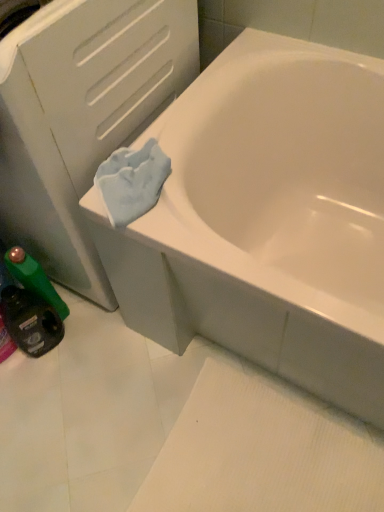
Describe the element at coordinates (81, 116) in the screenshot. I see `white matte file cabinet at upper left` at that location.

Find the location of a particular element. green plastic mouthwash at lower left, which appears as the second mouthwash when viewed from the top is located at coordinates (30, 321).

Find the location of `white glossy bathtub at upper right`. white glossy bathtub at upper right is located at coordinates (267, 219).

Which is behind, green plastic bottle at lower left, which is counted as the 2th mouthwash, starting from the bottom, or white glossy bathtub at upper right?

green plastic bottle at lower left, which is counted as the 2th mouthwash, starting from the bottom, is further from the camera.

Would you say green plastic bottle at lower left, the 1th mouthwash in the top-to-bottom sequence, is outside white glossy bathtub at upper right?

Yes, green plastic bottle at lower left, the 1th mouthwash in the top-to-bottom sequence, is outside of white glossy bathtub at upper right.

Does green plastic bottle at lower left, the 1th mouthwash in the top-to-bottom sequence, have a smaller size compared to white glossy bathtub at upper right?

Indeed, green plastic bottle at lower left, the 1th mouthwash in the top-to-bottom sequence, has a smaller size compared to white glossy bathtub at upper right.

Is green plastic bottle at lower left, the 1th mouthwash in the top-to-bottom sequence, positioned far away from white glossy bathtub at upper right?

Actually, green plastic bottle at lower left, the 1th mouthwash in the top-to-bottom sequence, and white glossy bathtub at upper right are a little close together.

Is white matte file cabinet at upper left far from white glossy bathtub at upper right?

No, white matte file cabinet at upper left is not far away from white glossy bathtub at upper right.

You are a GUI agent. You are given a task and a screenshot of the screen. Output one action in this format:
    pyautogui.click(x=<x>, y=<y>)
    Task: Click on the file cabinet on the left of white glossy bathtub at upper right
    This screenshot has height=512, width=384.
    Given the screenshot: What is the action you would take?
    pyautogui.click(x=81, y=116)

What's the angular difference between white matte file cabinet at upper left and white glossy bathtub at upper right's facing directions?

The angular difference between white matte file cabinet at upper left and white glossy bathtub at upper right is 7.59e-06 degrees.

Which of these two, white matte file cabinet at upper left or white glossy bathtub at upper right, is smaller?

white matte file cabinet at upper left is smaller.

From a real-world perspective, is green plastic mouthwash at lower left, which appears as the second mouthwash when viewed from the top, positioned under green plastic bottle at lower left, the 1th mouthwash in the top-to-bottom sequence, based on gravity?

Yes.

Considering the positions of point (35, 351) and point (13, 274), is point (35, 351) closer or farther from the camera than point (13, 274)?

Point (35, 351) is positioned farther from the camera compared to point (13, 274).

Are green plastic mouthwash at lower left, the first mouthwash positioned from the bottom, and green plastic bottle at lower left, which is counted as the 2th mouthwash, starting from the bottom, far apart?

Actually, green plastic mouthwash at lower left, the first mouthwash positioned from the bottom, and green plastic bottle at lower left, which is counted as the 2th mouthwash, starting from the bottom, are a little close together.

Between green plastic mouthwash at lower left, which appears as the second mouthwash when viewed from the top, and green plastic bottle at lower left, the 1th mouthwash in the top-to-bottom sequence, which one has larger width?

green plastic mouthwash at lower left, which appears as the second mouthwash when viewed from the top, is wider.

Looking at this image, is green plastic bottle at lower left, the 1th mouthwash in the top-to-bottom sequence, inside white matte file cabinet at upper left?

No, green plastic bottle at lower left, the 1th mouthwash in the top-to-bottom sequence, is not surrounded by white matte file cabinet at upper left.

Does white matte file cabinet at upper left have a greater width compared to green plastic bottle at lower left, which is counted as the 2th mouthwash, starting from the bottom?

Correct, the width of white matte file cabinet at upper left exceeds that of green plastic bottle at lower left, which is counted as the 2th mouthwash, starting from the bottom.

There is a white matte file cabinet at upper left. Identify the location of the 1st mouthwash below it (from the image's perspective). (34, 279).

Is green plastic bottle at lower left, which is counted as the 2th mouthwash, starting from the bottom, at the back of white matte file cabinet at upper left?

That's not correct — white matte file cabinet at upper left is not looking away from green plastic bottle at lower left, which is counted as the 2th mouthwash, starting from the bottom.

Starting from the white glossy bathtub at upper right, which mouthwash is the 1st one to the left? Please provide its 2D coordinates.

[(34, 279)]

How far apart are white glossy bathtub at upper right and green plastic bottle at lower left, the 1th mouthwash in the top-to-bottom sequence?

white glossy bathtub at upper right and green plastic bottle at lower left, the 1th mouthwash in the top-to-bottom sequence, are 23.29 inches apart from each other.

Based on their sizes in the image, would you say white glossy bathtub at upper right is bigger or smaller than green plastic bottle at lower left, which is counted as the 2th mouthwash, starting from the bottom?

white glossy bathtub at upper right is bigger than green plastic bottle at lower left, which is counted as the 2th mouthwash, starting from the bottom.

Would you say white glossy bathtub at upper right is inside or outside green plastic bottle at lower left, the 1th mouthwash in the top-to-bottom sequence?

white glossy bathtub at upper right exists outside the volume of green plastic bottle at lower left, the 1th mouthwash in the top-to-bottom sequence.

Measure the distance between white matte file cabinet at upper left and green plastic mouthwash at lower left, which appears as the second mouthwash when viewed from the top.

A distance of 44.36 centimeters exists between white matte file cabinet at upper left and green plastic mouthwash at lower left, which appears as the second mouthwash when viewed from the top.

Which is in front, point (136, 2) or point (8, 288)?

The point (136, 2) is closer.

Between white matte file cabinet at upper left and green plastic mouthwash at lower left, the first mouthwash positioned from the bottom, which one has less height?

Standing shorter between the two is green plastic mouthwash at lower left, the first mouthwash positioned from the bottom.

Find the location of a particular element. mouthwash that is the 2nd one when counting downward from the white matte file cabinet at upper left (from the image's perspective) is located at coordinates (30, 321).

Is white glossy bathtub at upper right far from green plastic mouthwash at lower left, the first mouthwash positioned from the bottom?

No, white glossy bathtub at upper right is not far away from green plastic mouthwash at lower left, the first mouthwash positioned from the bottom.

Which object is closer to the camera taking this photo, white glossy bathtub at upper right or green plastic mouthwash at lower left, which appears as the second mouthwash when viewed from the top?

white glossy bathtub at upper right.

Considering the positions of objects white glossy bathtub at upper right and green plastic mouthwash at lower left, the first mouthwash positioned from the bottom, in the image provided, who is more to the left, white glossy bathtub at upper right or green plastic mouthwash at lower left, the first mouthwash positioned from the bottom,?

From the viewer's perspective, green plastic mouthwash at lower left, the first mouthwash positioned from the bottom, appears more on the left side.

Where is `the 1st mouthwash to the left of the white glossy bathtub at upper right, starting your count from the anchor`? The width and height of the screenshot is (384, 512). the 1st mouthwash to the left of the white glossy bathtub at upper right, starting your count from the anchor is located at coordinates (34, 279).

The height and width of the screenshot is (512, 384). What are the coordinates of `bathtub to the right of white matte file cabinet at upper left` in the screenshot? It's located at (267, 219).

Consider the image. Which object lies nearer to the anchor point green plastic mouthwash at lower left, which appears as the second mouthwash when viewed from the top, white matte file cabinet at upper left or green plastic bottle at lower left, which is counted as the 2th mouthwash, starting from the bottom?

green plastic bottle at lower left, which is counted as the 2th mouthwash, starting from the bottom, lies closer to green plastic mouthwash at lower left, which appears as the second mouthwash when viewed from the top, than the other object.

From the image, which object appears to be farther from green plastic mouthwash at lower left, the first mouthwash positioned from the bottom, green plastic bottle at lower left, the 1th mouthwash in the top-to-bottom sequence, or white glossy bathtub at upper right?

Based on the image, white glossy bathtub at upper right appears to be further to green plastic mouthwash at lower left, the first mouthwash positioned from the bottom.

Considering their positions, is green plastic bottle at lower left, the 1th mouthwash in the top-to-bottom sequence, positioned closer to white matte file cabinet at upper left than green plastic mouthwash at lower left, which appears as the second mouthwash when viewed from the top?

Among the two, green plastic bottle at lower left, the 1th mouthwash in the top-to-bottom sequence, is located nearer to white matte file cabinet at upper left.

When comparing their distances from white matte file cabinet at upper left, does green plastic bottle at lower left, the 1th mouthwash in the top-to-bottom sequence, or white glossy bathtub at upper right seem further?

green plastic bottle at lower left, the 1th mouthwash in the top-to-bottom sequence, lies further to white matte file cabinet at upper left than the other object.

Based on their spatial positions, is green plastic mouthwash at lower left, the first mouthwash positioned from the bottom, or white matte file cabinet at upper left closer to green plastic bottle at lower left, the 1th mouthwash in the top-to-bottom sequence?

green plastic mouthwash at lower left, the first mouthwash positioned from the bottom, lies closer to green plastic bottle at lower left, the 1th mouthwash in the top-to-bottom sequence, than the other object.

Looking at the image, which one is located closer to white matte file cabinet at upper left, white glossy bathtub at upper right or green plastic bottle at lower left, the 1th mouthwash in the top-to-bottom sequence?

white glossy bathtub at upper right is positioned closer to the anchor white matte file cabinet at upper left.

From the image, which object appears to be farther from white glossy bathtub at upper right, green plastic mouthwash at lower left, which appears as the second mouthwash when viewed from the top, or white matte file cabinet at upper left?

The object further to white glossy bathtub at upper right is green plastic mouthwash at lower left, which appears as the second mouthwash when viewed from the top.

Estimate the real-world distances between objects in this image. Which object is closer to green plastic bottle at lower left, which is counted as the 2th mouthwash, starting from the bottom, white glossy bathtub at upper right or white matte file cabinet at upper left?

Among the two, white matte file cabinet at upper left is located nearer to green plastic bottle at lower left, which is counted as the 2th mouthwash, starting from the bottom.

You are a GUI agent. You are given a task and a screenshot of the screen. Output one action in this format:
    pyautogui.click(x=<x>, y=<y>)
    Task: Click on the file cabinet between green plastic mouthwash at lower left, which appears as the second mouthwash when viewed from the top, and white glossy bathtub at upper right from left to right
    
    Given the screenshot: What is the action you would take?
    pyautogui.click(x=81, y=116)

This screenshot has width=384, height=512. Find the location of `mouthwash between white matte file cabinet at upper left and green plastic mouthwash at lower left, which appears as the second mouthwash when viewed from the top, in the up-down direction`. mouthwash between white matte file cabinet at upper left and green plastic mouthwash at lower left, which appears as the second mouthwash when viewed from the top, in the up-down direction is located at coordinates (34, 279).

Locate an element on the screen. The height and width of the screenshot is (512, 384). file cabinet between green plastic bottle at lower left, which is counted as the 2th mouthwash, starting from the bottom, and white glossy bathtub at upper right, in the horizontal direction is located at coordinates (81, 116).

At what (x,y) coordinates should I click in order to perform the action: click on mouthwash situated between green plastic mouthwash at lower left, the first mouthwash positioned from the bottom, and white glossy bathtub at upper right from left to right. Please return your answer as a coordinate pair (x, y). The width and height of the screenshot is (384, 512). Looking at the image, I should click on (34, 279).